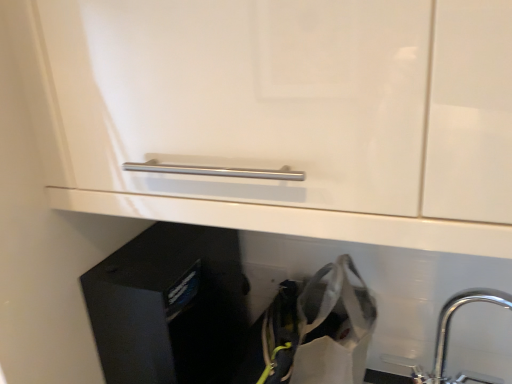
Find the location of a particular element. empty space that is ontop of black matte file cabinet at lower left is located at coordinates (147, 245).